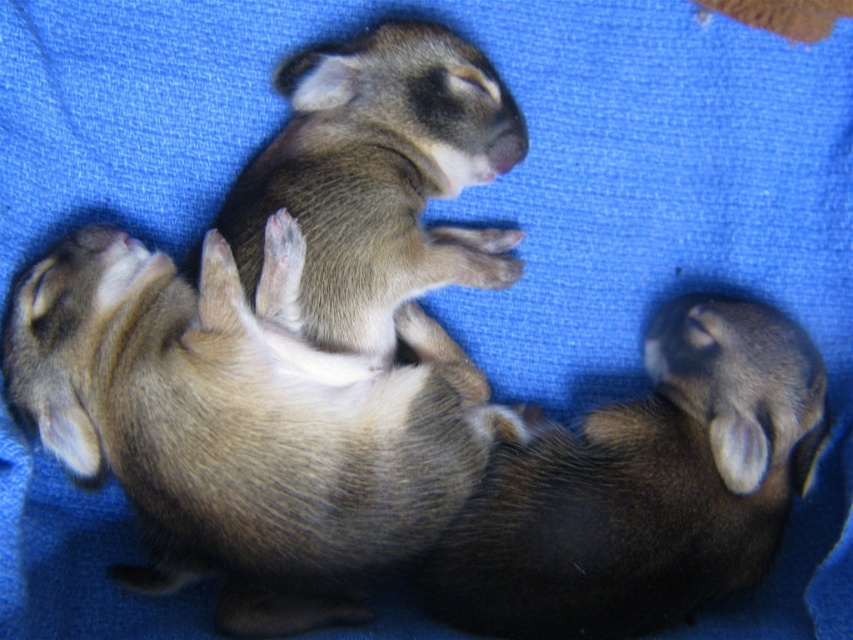
Does brown fuzzy rabbit at lower right have a lesser height compared to fuzzy brown puppy at center?

Incorrect, brown fuzzy rabbit at lower right's height does not fall short of fuzzy brown puppy at center's.

Is point (572, 440) positioned in front of point (410, 241)?

No, (572, 440) is behind (410, 241).

The image size is (853, 640). I want to click on brown fuzzy rabbit at lower right, so click(x=641, y=486).

Identify the location of brown fuzzy rabbit at lower right. The height and width of the screenshot is (640, 853). (641, 486).

Between brown fuzzy puppy at center and fuzzy brown puppy at center, which one appears on the right side from the viewer's perspective?

From the viewer's perspective, fuzzy brown puppy at center appears more on the right side.

Between brown fuzzy puppy at center and fuzzy brown puppy at center, which one is positioned lower?

Positioned lower is brown fuzzy puppy at center.

Is point (245, 461) in front of point (509, 237)?

Yes, it is.

This screenshot has height=640, width=853. In order to click on brown fuzzy puppy at center in this screenshot , I will do (x=247, y=419).

Does brown fuzzy puppy at center have a greater width compared to brown fuzzy rabbit at lower right?

Indeed, brown fuzzy puppy at center has a greater width compared to brown fuzzy rabbit at lower right.

Who is shorter, brown fuzzy puppy at center or brown fuzzy rabbit at lower right?

brown fuzzy rabbit at lower right

Does point (283, 579) lie behind point (525, 456)?

No, it is not.

The image size is (853, 640). Find the location of `brown fuzzy puppy at center`. brown fuzzy puppy at center is located at coordinates (247, 419).